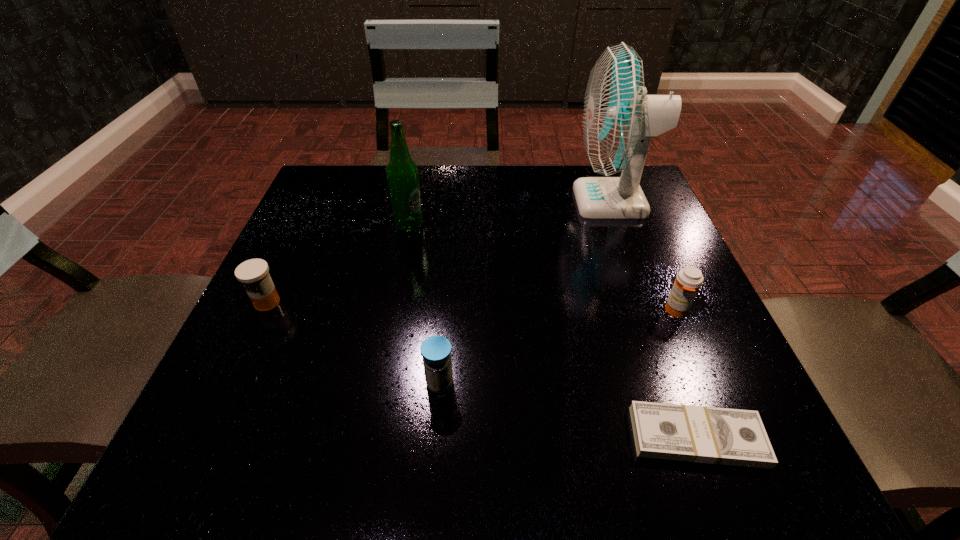
The height and width of the screenshot is (540, 960). I want to click on free region located in front of the fan to face the airflow, so click(538, 201).

Locate an element on the screen. vacant space located in front of the fan to face the airflow is located at coordinates (538, 201).

Locate an element on the screen. vacant space located on the label of the second tallest object is located at coordinates (473, 225).

The height and width of the screenshot is (540, 960). I want to click on vacant space located on the back of the rightmost medicine, so click(656, 262).

At what (x,y) coordinates should I click in order to perform the action: click on vacant region located 0.170m on the back of the second nearest object. Please return your answer as a coordinate pair (x, y). The image size is (960, 540). Looking at the image, I should click on pos(446,295).

What are the coordinates of `free space located 0.390m on the label of the leftmost medicine` in the screenshot? It's located at (490, 302).

Locate an element on the screen. The height and width of the screenshot is (540, 960). free point located on the left of the dollar is located at coordinates (480, 437).

Image resolution: width=960 pixels, height=540 pixels. In order to click on fan at the far edge in this screenshot , I will do click(619, 119).

At what (x,y) coordinates should I click in order to perform the action: click on beer bottle that is at the far edge. Please return your answer as a coordinate pair (x, y). This screenshot has height=540, width=960. Looking at the image, I should click on (402, 174).

Where is `object at the near edge`? The image size is (960, 540). object at the near edge is located at coordinates (700, 434).